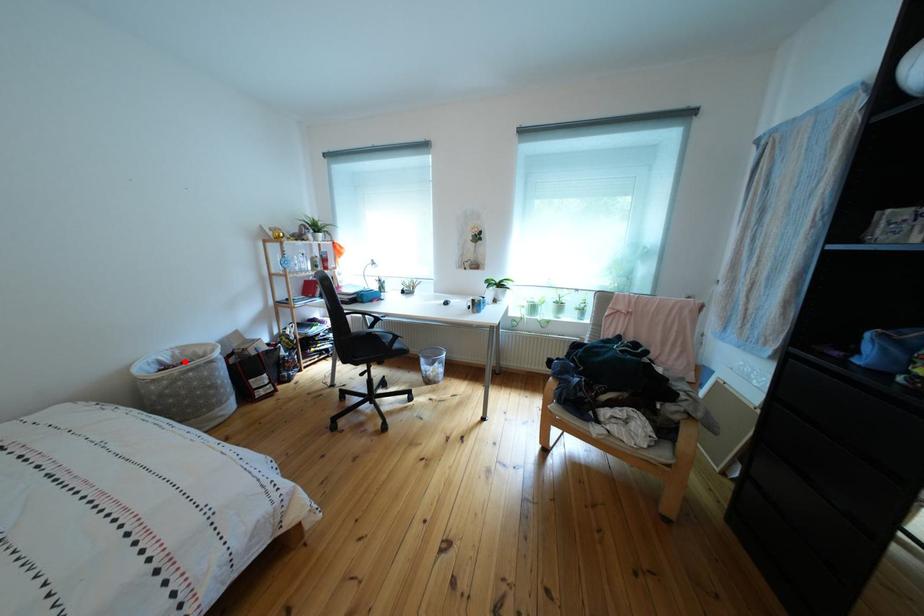
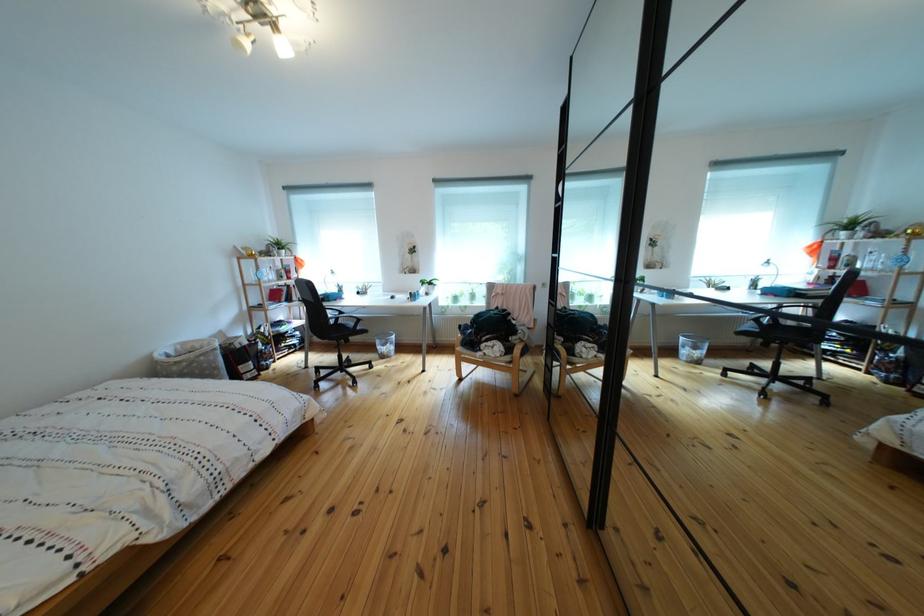
The point at the highlighted location is marked in the first image. Where is the corresponding point in the second image?

(187, 355)